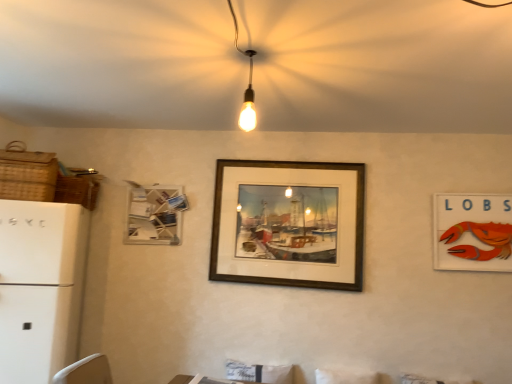
Question: Is white matte refrigerator at left bigger than white matte picture frame at upper left, the first picture frame when ordered from left to right?

Choices:
 (A) yes
 (B) no

Answer: (A)

Question: From the image's perspective, would you say white matte refrigerator at left is shown under white matte picture frame at upper left, the first picture frame when ordered from left to right?

Choices:
 (A) yes
 (B) no

Answer: (A)

Question: Is white matte refrigerator at left positioned before white matte picture frame at upper left, which is the 3th picture frame from right to left?

Choices:
 (A) no
 (B) yes

Answer: (B)

Question: Considering the relative sizes of white matte refrigerator at left and white matte picture frame at upper left, the first picture frame when ordered from left to right, in the image provided, is white matte refrigerator at left smaller than white matte picture frame at upper left, the first picture frame when ordered from left to right,?

Choices:
 (A) no
 (B) yes

Answer: (A)

Question: Does white matte refrigerator at left appear on the left side of white matte picture frame at upper left, the first picture frame when ordered from left to right?

Choices:
 (A) yes
 (B) no

Answer: (A)

Question: In terms of size, does white matte picture frame at upper left, which is the 3th picture frame from right to left, appear bigger or smaller than woven brown basket at upper left, placed as the second basket when sorted from front to back?

Choices:
 (A) small
 (B) big

Answer: (B)

Question: Is white matte picture frame at upper left, the first picture frame when ordered from left to right, in front of or behind woven brown basket at upper left, placed as the second basket when sorted from front to back, in the image?

Choices:
 (A) front
 (B) behind

Answer: (B)

Question: From a real-world perspective, is white matte picture frame at upper left, the first picture frame when ordered from left to right, physically located above or below woven brown basket at upper left, marked as the first basket in a back-to-front arrangement?

Choices:
 (A) above
 (B) below

Answer: (B)

Question: In terms of height, does white matte picture frame at upper left, the first picture frame when ordered from left to right, look taller or shorter compared to woven brown basket at upper left, marked as the first basket in a back-to-front arrangement?

Choices:
 (A) tall
 (B) short

Answer: (A)

Question: From a real-world perspective, is wooden frame at center, the second picture frame viewed from the left, physically located above or below woven brown basket at upper left, marked as the first basket in a back-to-front arrangement?

Choices:
 (A) below
 (B) above

Answer: (A)

Question: Looking at the image, does wooden frame at center, arranged as the 2th picture frame when viewed from the right, seem bigger or smaller compared to woven brown basket at upper left, placed as the second basket when sorted from front to back?

Choices:
 (A) big
 (B) small

Answer: (A)

Question: From their relative heights in the image, would you say wooden frame at center, the second picture frame viewed from the left, is taller or shorter than woven brown basket at upper left, placed as the second basket when sorted from front to back?

Choices:
 (A) short
 (B) tall

Answer: (B)

Question: Looking at their shapes, would you say wooden frame at center, arranged as the 2th picture frame when viewed from the right, is wider or thinner than woven brown basket at upper left, placed as the second basket when sorted from front to back?

Choices:
 (A) wide
 (B) thin

Answer: (B)

Question: Is white matte refrigerator at left to the left or to the right of orange felt lobster sign at right, marked as the third picture frame in a left-to-right arrangement, in the image?

Choices:
 (A) left
 (B) right

Answer: (A)

Question: Is white matte refrigerator at left wider or thinner than orange felt lobster sign at right, marked as the third picture frame in a left-to-right arrangement?

Choices:
 (A) thin
 (B) wide

Answer: (B)